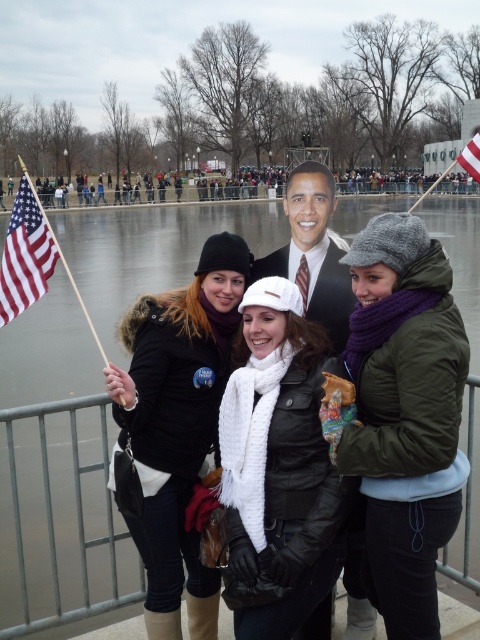
Based on the scene description, you are an event planner organizing a winter festival. You need to place a new banner between the metal fence at lower center and the american flag at upper right. Which object should the banner be placed closer to if you want it to be more noticeable to attendees entering from the front?

The banner should be placed closer to the american flag at upper right because it is larger in size compared to the metal fence at lower center, making it a better focal point for visibility.